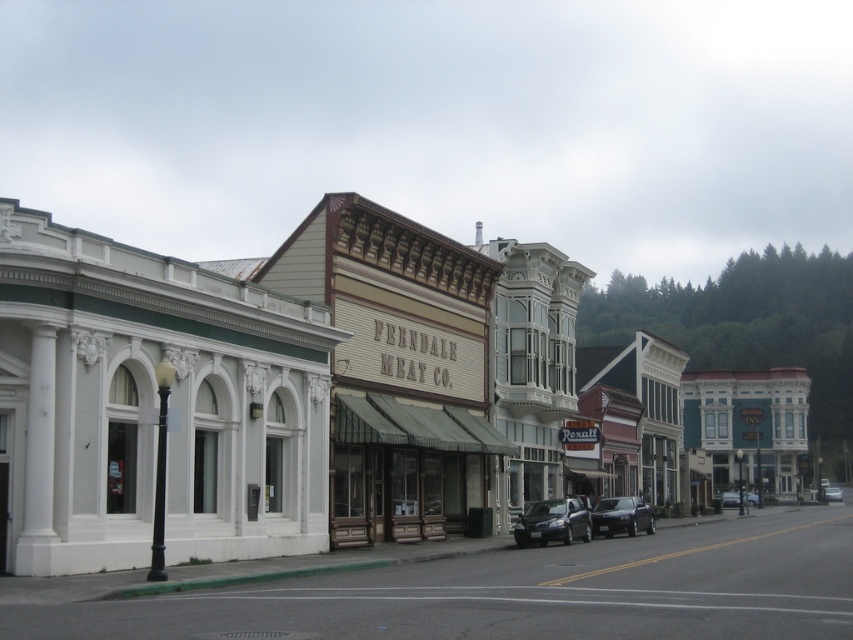
Question: Which of the following is the farthest from the observer?

Choices:
 (A) (448, 506)
 (B) (727, 500)

Answer: (B)

Question: Does white painted building at center have a lesser width compared to shiny dark blue sedan at center?

Choices:
 (A) yes
 (B) no

Answer: (B)

Question: Which object is positioned closest to the shiny dark blue sedan at center?

Choices:
 (A) white painted building at center
 (B) silver metallic sedan at center
 (C) metallic blue sedan at center
 (D) green awning at center

Answer: (D)

Question: From the image, what is the correct spatial relationship of white painted building at center in relation to shiny dark blue sedan at center?

Choices:
 (A) left
 (B) right

Answer: (A)

Question: Is white painted building at center positioned at the back of silver metallic sedan at center?

Choices:
 (A) no
 (B) yes

Answer: (A)

Question: Which point is farther to the camera?

Choices:
 (A) silver metallic sedan at center
 (B) shiny black sedan at center

Answer: (A)